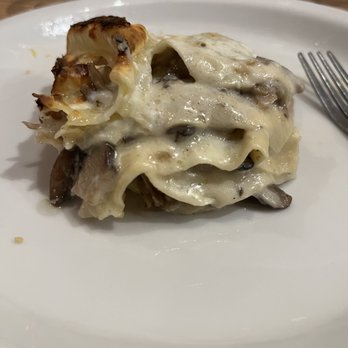
You are a GUI agent. You are given a task and a screenshot of the screen. Output one action in this format:
    pyautogui.click(x=<x>, y=<y>)
    Task: Click on the white plate below food
    This screenshot has height=348, width=348.
    Given the screenshot: What is the action you would take?
    click(x=186, y=286)